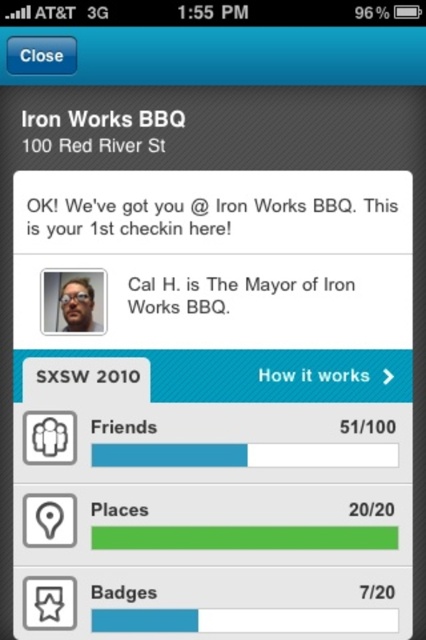
You are using a mobile app to find a restaurant. You see the black paper text at center and the matte black glasses at upper center on the screen. Which object takes up more space visually?

The black paper text at center is larger in size than the matte black glasses at upper center, so it takes up more visual space.

You are using a mobile app and see the Iron Works BBQ page. The white paper text at center and the black matte text at upper center are both visible. Which text is closer to you?

The white paper text at center is closer to you because it is further to the viewer than the black matte text at upper center.